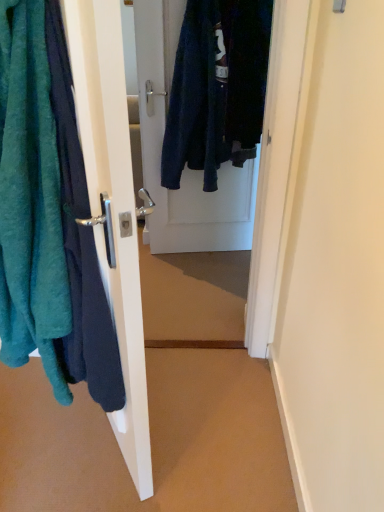
Question: Is teal fuzzy towel at left smaller than matte white door handle at left, the 1th door positioned from the left?

Choices:
 (A) yes
 (B) no

Answer: (B)

Question: Considering the relative sizes of teal fuzzy towel at left and matte white door handle at left, positioned as the second door in back-to-front order, in the image provided, is teal fuzzy towel at left taller than matte white door handle at left, positioned as the second door in back-to-front order,?

Choices:
 (A) no
 (B) yes

Answer: (A)

Question: From the image's perspective, is teal fuzzy towel at left located beneath matte white door handle at left, the first door from the front?

Choices:
 (A) yes
 (B) no

Answer: (B)

Question: Is teal fuzzy towel at left outside of matte white door handle at left, placed as the second door when sorted from right to left?

Choices:
 (A) yes
 (B) no

Answer: (A)

Question: Does teal fuzzy towel at left have a lesser height compared to matte white door handle at left, positioned as the second door in back-to-front order?

Choices:
 (A) no
 (B) yes

Answer: (B)

Question: Can you confirm if teal fuzzy towel at left is positioned to the left of matte white door handle at left, the first door from the front?

Choices:
 (A) yes
 (B) no

Answer: (A)

Question: Does matte white door handle at left, placed as the second door when sorted from right to left, appear on the left side of velvet dark blue coat at center, which is the first door in back-to-front order?

Choices:
 (A) yes
 (B) no

Answer: (A)

Question: Does matte white door handle at left, placed as the second door when sorted from right to left, lie behind velvet dark blue coat at center, acting as the 2th door starting from the front?

Choices:
 (A) no
 (B) yes

Answer: (A)

Question: Is matte white door handle at left, the 1th door positioned from the left, closer to the viewer compared to velvet dark blue coat at center, the 2th door when ordered from left to right?

Choices:
 (A) yes
 (B) no

Answer: (A)

Question: From a real-world perspective, is matte white door handle at left, placed as the second door when sorted from right to left, on velvet dark blue coat at center, the 2th door when ordered from left to right?

Choices:
 (A) no
 (B) yes

Answer: (A)

Question: Considering the relative sizes of matte white door handle at left, placed as the second door when sorted from right to left, and velvet dark blue coat at center, acting as the 2th door starting from the front, in the image provided, is matte white door handle at left, placed as the second door when sorted from right to left, shorter than velvet dark blue coat at center, acting as the 2th door starting from the front,?

Choices:
 (A) yes
 (B) no

Answer: (A)

Question: From the image's perspective, would you say matte white door handle at left, the 1th door positioned from the left, is shown under velvet dark blue coat at center, marked as the first door in a right-to-left arrangement?

Choices:
 (A) yes
 (B) no

Answer: (A)

Question: Considering the relative positions of matte white door handle at left, placed as the second door when sorted from right to left, and teal fuzzy towel at left in the image provided, is matte white door handle at left, placed as the second door when sorted from right to left, to the left of teal fuzzy towel at left from the viewer's perspective?

Choices:
 (A) no
 (B) yes

Answer: (A)